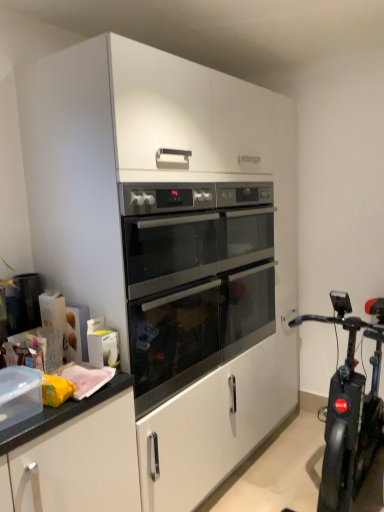
Question: From the image's perspective, is stainless steel oven at center above or below black glossy stationary bicycle at right?

Choices:
 (A) below
 (B) above

Answer: (B)

Question: Do you think stainless steel oven at center is within black glossy stationary bicycle at right, or outside of it?

Choices:
 (A) outside
 (B) inside

Answer: (A)

Question: Would you say stainless steel oven at center is to the left or to the right of black glossy stationary bicycle at right in the picture?

Choices:
 (A) right
 (B) left

Answer: (B)

Question: Is black glossy stationary bicycle at right wider or thinner than stainless steel oven at center?

Choices:
 (A) wide
 (B) thin

Answer: (A)

Question: Considering their positions, is black glossy stationary bicycle at right located in front of or behind stainless steel oven at center?

Choices:
 (A) behind
 (B) front

Answer: (B)

Question: Looking at the image, does black glossy stationary bicycle at right seem bigger or smaller compared to stainless steel oven at center?

Choices:
 (A) big
 (B) small

Answer: (A)

Question: Is black glossy stationary bicycle at right to the left or to the right of stainless steel oven at center in the image?

Choices:
 (A) right
 (B) left

Answer: (A)